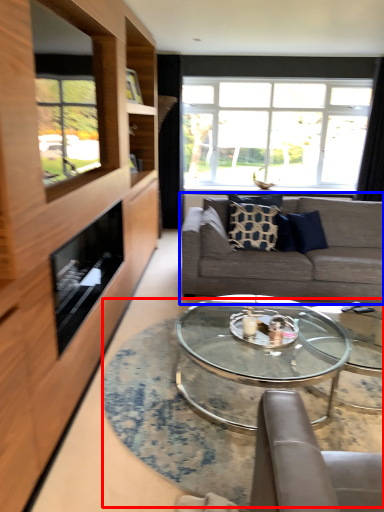
Question: Among these objects, which one is farthest to the camera, table (highlighted by a red box) or studio couch (highlighted by a blue box)?

Choices:
 (A) table
 (B) studio couch

Answer: (B)